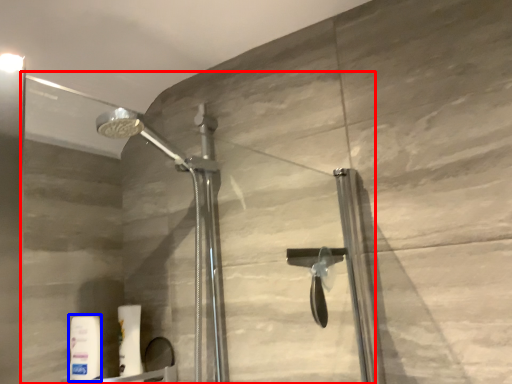
Question: Which object appears farthest to the camera in this image, glass door (highlighted by a red box) or toiletry (highlighted by a blue box)?

Choices:
 (A) glass door
 (B) toiletry

Answer: (B)